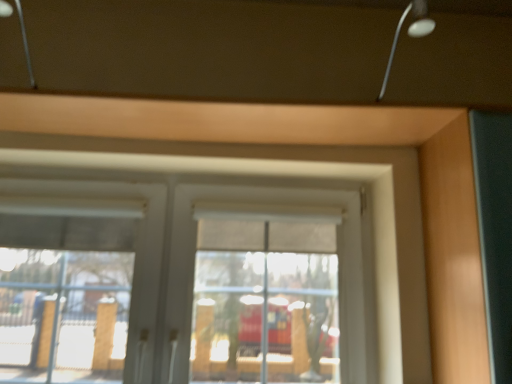
Question: Is matte wood garage door at right aimed at white matte window at center?

Choices:
 (A) yes
 (B) no

Answer: (B)

Question: Is the depth of matte wood garage door at right greater than that of white matte window at center?

Choices:
 (A) no
 (B) yes

Answer: (A)

Question: Does matte wood garage door at right have a smaller size compared to white matte window at center?

Choices:
 (A) no
 (B) yes

Answer: (B)

Question: Is matte wood garage door at right to the left of white matte window at center from the viewer's perspective?

Choices:
 (A) yes
 (B) no

Answer: (B)

Question: Does matte wood garage door at right lie in front of white matte window at center?

Choices:
 (A) yes
 (B) no

Answer: (A)

Question: From the image's perspective, relative to matte wood garage door at right, is metallic silver lamp at upper right, which is the 2th lamp from left to right, above or below?

Choices:
 (A) below
 (B) above

Answer: (B)

Question: Does point (387, 74) appear closer or farther from the camera than point (419, 183)?

Choices:
 (A) closer
 (B) farther

Answer: (B)

Question: From a real-world perspective, relative to matte wood garage door at right, is metallic silver lamp at upper right, the 1th lamp in the right-to-left sequence, vertically above or below?

Choices:
 (A) below
 (B) above

Answer: (B)

Question: Choose the correct answer: Is metallic silver lamp at upper right, which is the 2th lamp from left to right, inside matte wood garage door at right or outside it?

Choices:
 (A) outside
 (B) inside

Answer: (A)

Question: Is metallic silver lamp at upper right, which is the 2th lamp from left to right, spatially inside white matte window at center, or outside of it?

Choices:
 (A) outside
 (B) inside

Answer: (A)

Question: Considering their positions, is metallic silver lamp at upper right, the 1th lamp in the right-to-left sequence, located in front of or behind white matte window at center?

Choices:
 (A) behind
 (B) front

Answer: (B)

Question: Is point (415, 31) closer or farther from the camera than point (173, 148)?

Choices:
 (A) farther
 (B) closer

Answer: (B)

Question: Is metallic silver lamp at upper right, the 1th lamp in the right-to-left sequence, to the left or to the right of white matte window at center in the image?

Choices:
 (A) left
 (B) right

Answer: (B)

Question: From a real-world perspective, is metallic silver lamp at upper left, which appears as the 1th lamp when viewed from the left, positioned above or below matte wood garage door at right?

Choices:
 (A) above
 (B) below

Answer: (A)

Question: Does point (1, 9) appear closer or farther from the camera than point (485, 355)?

Choices:
 (A) farther
 (B) closer

Answer: (A)